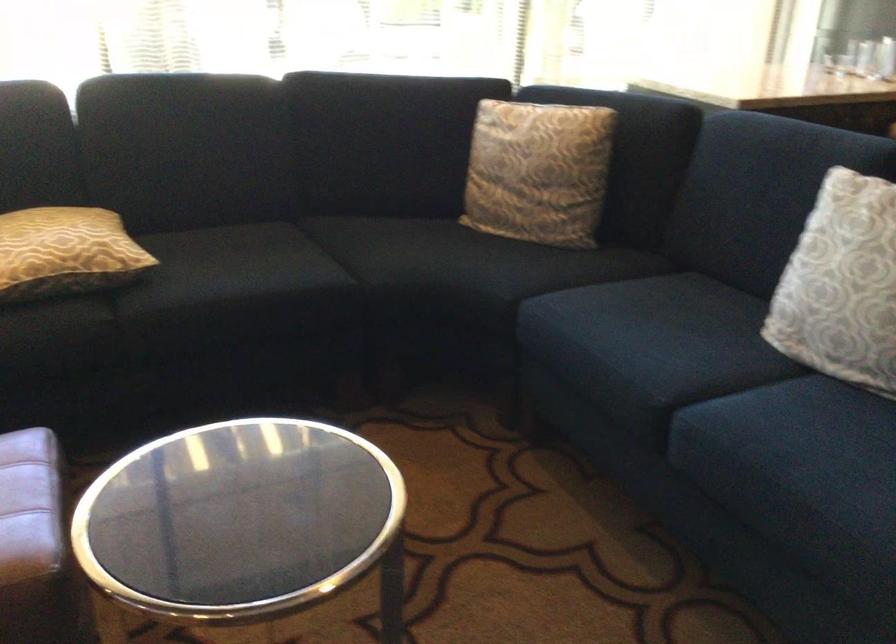
You are a GUI agent. You are given a task and a screenshot of the screen. Output one action in this format:
    pyautogui.click(x=<x>, y=<y>)
    Task: Click on the sofa sitting surface
    The image size is (896, 644).
    Given the screenshot: What is the action you would take?
    pyautogui.click(x=391, y=261)